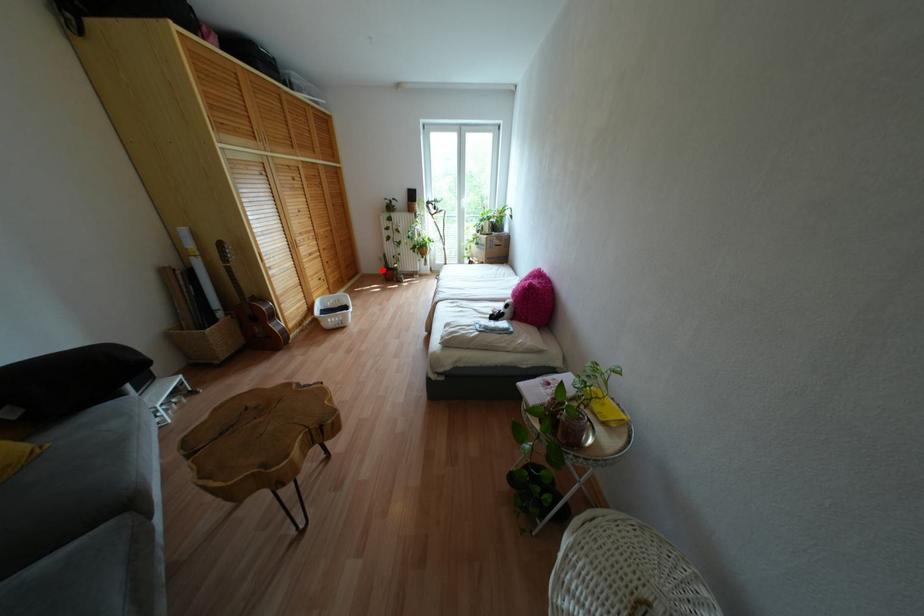
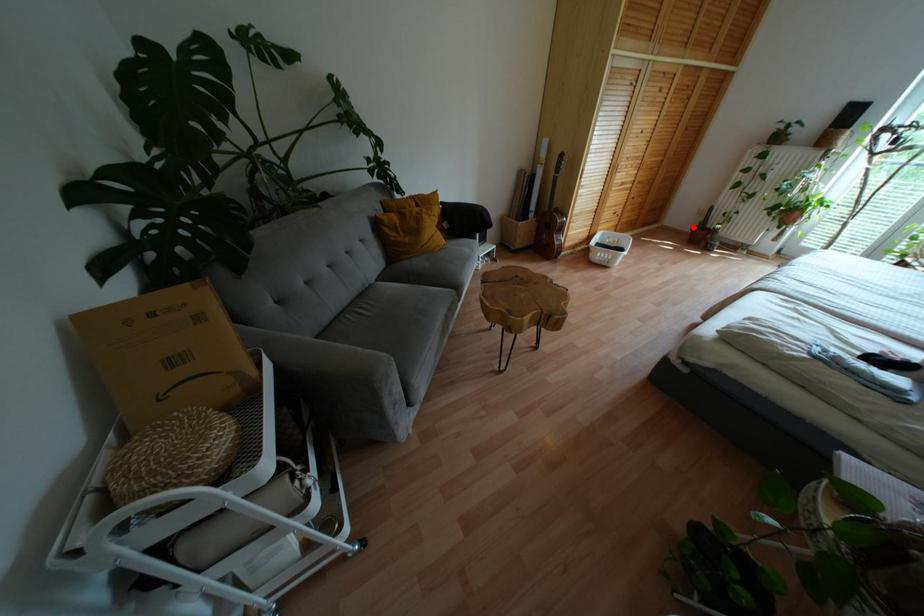
I am providing you with two images of the same scene from different viewpoints. A red point is marked on the first image and another point is marked on the second image. Is the red point in image1 aligned with the point shown in image2?

Yes